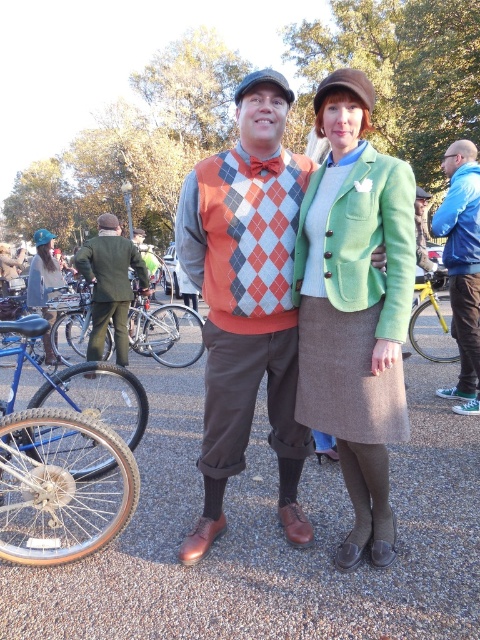
You are standing at the center of the scene and want to take a photo of the two people. The camera you are using has a focal length of 50mm and a sensor size of 24mm x 36mm. The person on the left is 1.7 meters tall and the point at coordinates point (x=300, y=456) is 2.90 meters away from you. Calculate the distance between the two people in the scene to ensure they both fit in the frame. Use the formula for field of view and provide your answer in meters.

Using the formula for field of view, the horizontal FOV is 2 arctan. The distance between the two people can be calculated using the coordinates and the given distance of point (x=300, y=456) being 2.90 meters from the viewer. However, without specific coordinates for both individuals, an exact calculation isn

You are a photographer positioned at the center of the scene. You want to take a photo that includes both the argyle sweater vest at center and the yellow metallic bicycle at right. Given that your camera has a maximum focus range of 4 meters, will you be able to capture both objects in focus without moving?

The argyle sweater vest at center is 4.59 meters away from the yellow metallic bicycle at right. Since the distance between them exceeds the camera maximum focus range of 4 meters, you won that capture both objects in focus without moving.

You are a photographer at the event and want to take a photo that includes both the person at point [268,289] and the person at point [462,173]. Based on their positions, which person is closer to the camera and should be in focus first?

Point [268,289] is in front of point [462,173], so the person at point [268,289] is closer to the camera and should be in focus first.